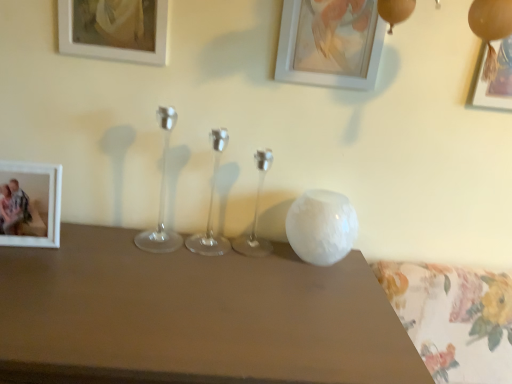
Question: Should I look upward or downward to see metallic gold picture frame at upper right, arranged as the fourth picture frame when viewed from the left?

Choices:
 (A) up
 (B) down

Answer: (A)

Question: Is white matte picture frame at upper center, which is counted as the 2th picture frame, starting from the right, in front of white matte picture frame at left, which is the 1th picture frame from left to right?

Choices:
 (A) yes
 (B) no

Answer: (B)

Question: Is white matte picture frame at upper center, which is counted as the 3th picture frame, starting from the left, at the right side of white matte picture frame at left, which is the 4th picture frame in right-to-left order?

Choices:
 (A) no
 (B) yes

Answer: (B)

Question: From the image's perspective, is white matte picture frame at upper center, which is counted as the 2th picture frame, starting from the right, beneath white matte picture frame at left, which is the 1th picture frame from left to right?

Choices:
 (A) yes
 (B) no

Answer: (B)

Question: Is white matte picture frame at upper center, which is counted as the 2th picture frame, starting from the right, to the left of white matte picture frame at left, which is the 1th picture frame from left to right, from the viewer's perspective?

Choices:
 (A) yes
 (B) no

Answer: (B)

Question: Can you confirm if white matte picture frame at upper center, which is counted as the 3th picture frame, starting from the left, is smaller than white matte picture frame at left, which is the 1th picture frame from left to right?

Choices:
 (A) no
 (B) yes

Answer: (B)

Question: From a real-world perspective, is white matte picture frame at upper center, which is counted as the 2th picture frame, starting from the right, on top of white matte picture frame at left, which is the 4th picture frame in right-to-left order?

Choices:
 (A) no
 (B) yes

Answer: (B)

Question: Considering the relative sizes of metallic gold picture frame at upper right, arranged as the fourth picture frame when viewed from the left, and white matte picture frame at upper center, which is counted as the 2th picture frame, starting from the right, in the image provided, is metallic gold picture frame at upper right, arranged as the fourth picture frame when viewed from the left, taller than white matte picture frame at upper center, which is counted as the 2th picture frame, starting from the right,?

Choices:
 (A) yes
 (B) no

Answer: (B)

Question: Would you say metallic gold picture frame at upper right, the 1th picture frame viewed from the right, is outside white matte picture frame at upper center, which is counted as the 3th picture frame, starting from the left?

Choices:
 (A) no
 (B) yes

Answer: (B)

Question: From the image's perspective, is metallic gold picture frame at upper right, the 1th picture frame viewed from the right, beneath white matte picture frame at upper center, which is counted as the 2th picture frame, starting from the right?

Choices:
 (A) no
 (B) yes

Answer: (B)

Question: Are metallic gold picture frame at upper right, the 1th picture frame viewed from the right, and white matte picture frame at upper center, which is counted as the 3th picture frame, starting from the left, beside each other?

Choices:
 (A) yes
 (B) no

Answer: (B)

Question: From a real-world perspective, is metallic gold picture frame at upper right, the 1th picture frame viewed from the right, positioned under white matte picture frame at upper center, which is counted as the 2th picture frame, starting from the right, based on gravity?

Choices:
 (A) yes
 (B) no

Answer: (A)

Question: Is the position of metallic gold picture frame at upper right, arranged as the fourth picture frame when viewed from the left, less distant than that of white matte picture frame at upper center, which is counted as the 2th picture frame, starting from the right?

Choices:
 (A) no
 (B) yes

Answer: (A)

Question: Is matte white picture frame at upper left, which ranks as the 3th picture frame in right-to-left order, wider than white matte picture frame at upper center, which is counted as the 2th picture frame, starting from the right?

Choices:
 (A) yes
 (B) no

Answer: (B)